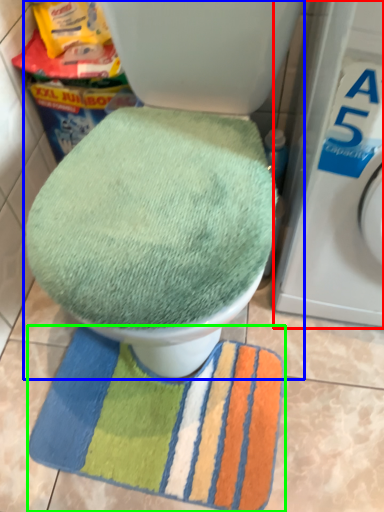
Question: Considering the real-world distances, which object is closest to washing machine (highlighted by a red box)? toilet (highlighted by a blue box) or beach towel (highlighted by a green box).

Choices:
 (A) toilet
 (B) beach towel

Answer: (A)